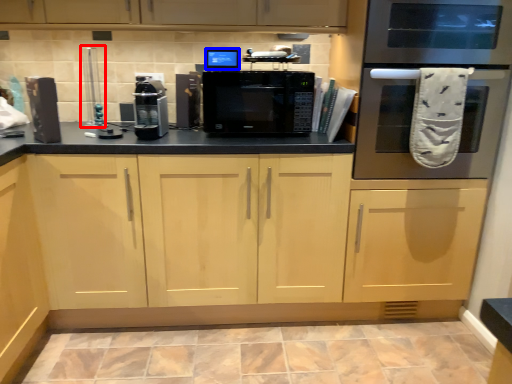
Question: Which object appears closest to the camera in this image, appliance (highlighted by a red box) or appliance (highlighted by a blue box)?

Choices:
 (A) appliance
 (B) appliance

Answer: (B)